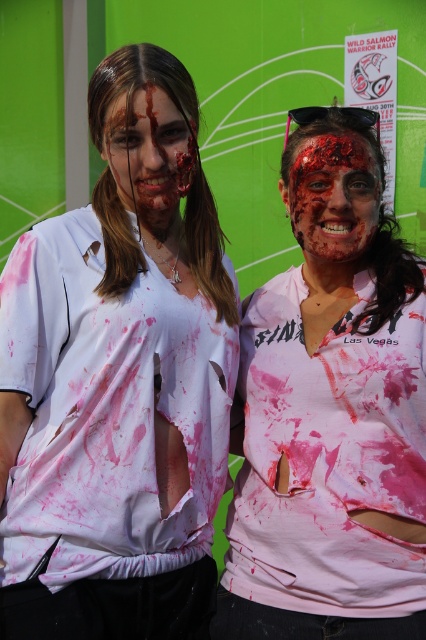
Can you confirm if bloody skin at center is thinner than blood-stained face at center?

No, bloody skin at center is not thinner than blood-stained face at center.

Between point (345, 243) and point (112, 154), which one is positioned in front?

Point (112, 154) is in front.

Where is `bloody skin at center`? The image size is (426, 640). bloody skin at center is located at coordinates (333, 196).

The width and height of the screenshot is (426, 640). What do you see at coordinates (118, 380) in the screenshot? I see `white matte shirt at center` at bounding box center [118, 380].

Which is below, white matte shirt at center or blood-stained face at center?

white matte shirt at center is below.

Where is `white matte shirt at center`? white matte shirt at center is located at coordinates (118, 380).

Who is taller, white matte shirt at center or bloody skin at center?

With more height is white matte shirt at center.

Is white matte shirt at center to the left of bloody skin at center from the viewer's perspective?

Indeed, white matte shirt at center is positioned on the left side of bloody skin at center.

I want to click on white matte shirt at center, so click(118, 380).

You are a GUI agent. You are given a task and a screenshot of the screen. Output one action in this format:
    pyautogui.click(x=<x>, y=<y>)
    Task: Click on the white matte shirt at center
    
    Given the screenshot: What is the action you would take?
    pyautogui.click(x=118, y=380)